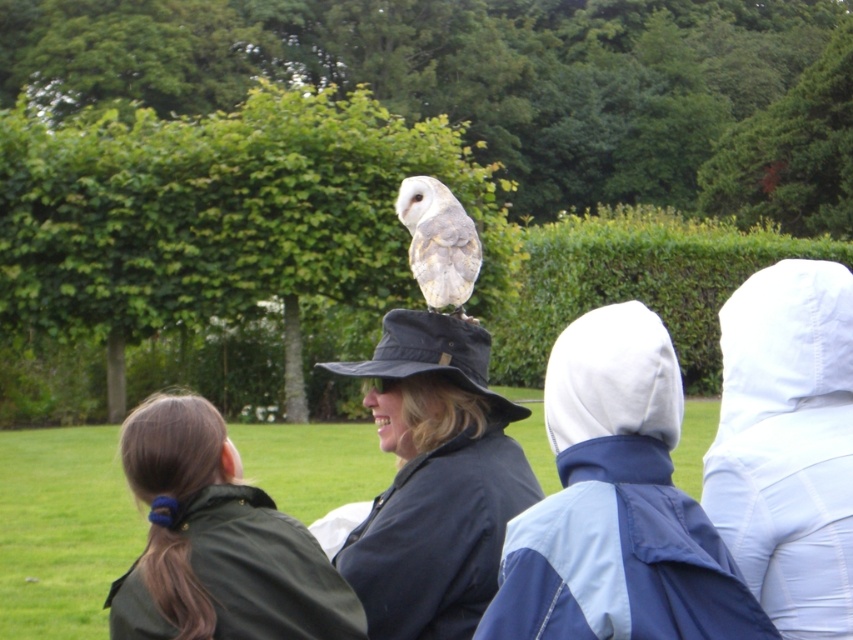
Question: Can you confirm if white fabric hood at center is wider than dark brown hair at lower left?

Choices:
 (A) no
 (B) yes

Answer: (A)

Question: Based on their relative distances, which object is farther from the white fabric hood at center?

Choices:
 (A) dark green jacket at lower left
 (B) green leafy hedge at upper center
 (C) dark brown hair at lower left

Answer: (B)

Question: Which object is positioned closest to the green leafy hedge at center?

Choices:
 (A) white feathered owl at center
 (B) green leafy hedge at upper center

Answer: (B)

Question: Does dark green jacket at lower left appear on the left side of dark brown hair at lower left?

Choices:
 (A) yes
 (B) no

Answer: (B)

Question: Does white fabric hood at center appear under dark brown hair at lower left?

Choices:
 (A) no
 (B) yes

Answer: (A)

Question: Which point is closer to the camera taking this photo?

Choices:
 (A) (115, 280)
 (B) (212, 468)

Answer: (B)